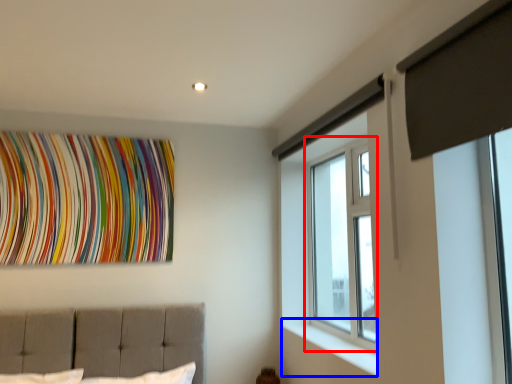
Question: Among these objects, which one is farthest to the camera, window (highlighted by a red box) or window sill (highlighted by a blue box)?

Choices:
 (A) window
 (B) window sill

Answer: (A)